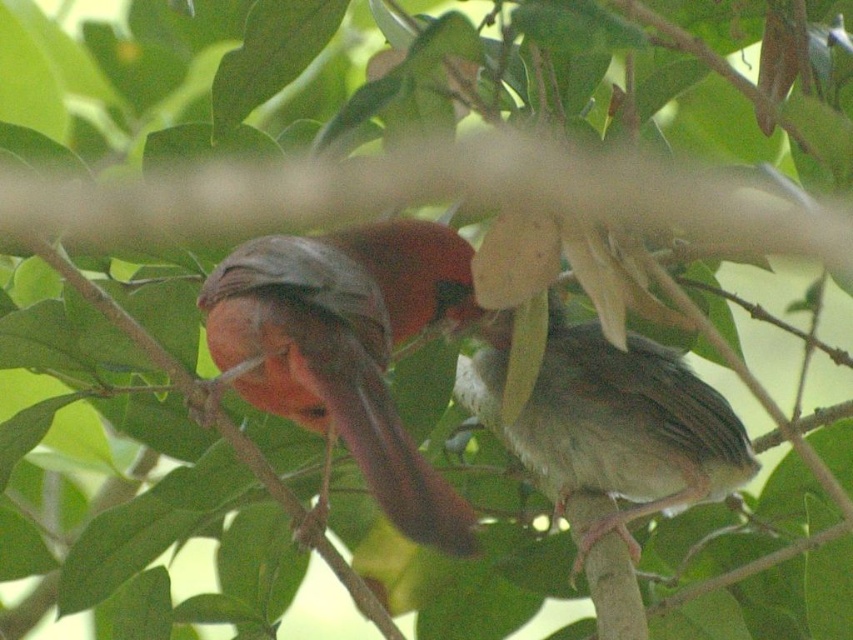
Question: Does matte orange bird at center appear under gray matte bird at center?

Choices:
 (A) yes
 (B) no

Answer: (B)

Question: Which point appears farthest from the camera in this image?

Choices:
 (A) (635, 513)
 (B) (401, 301)

Answer: (A)

Question: Is matte orange bird at center to the right of gray matte bird at center from the viewer's perspective?

Choices:
 (A) no
 (B) yes

Answer: (A)

Question: Is matte orange bird at center in front of gray matte bird at center?

Choices:
 (A) no
 (B) yes

Answer: (B)

Question: Which point is farther from the camera taking this photo?

Choices:
 (A) (421, 486)
 (B) (705, 493)

Answer: (B)